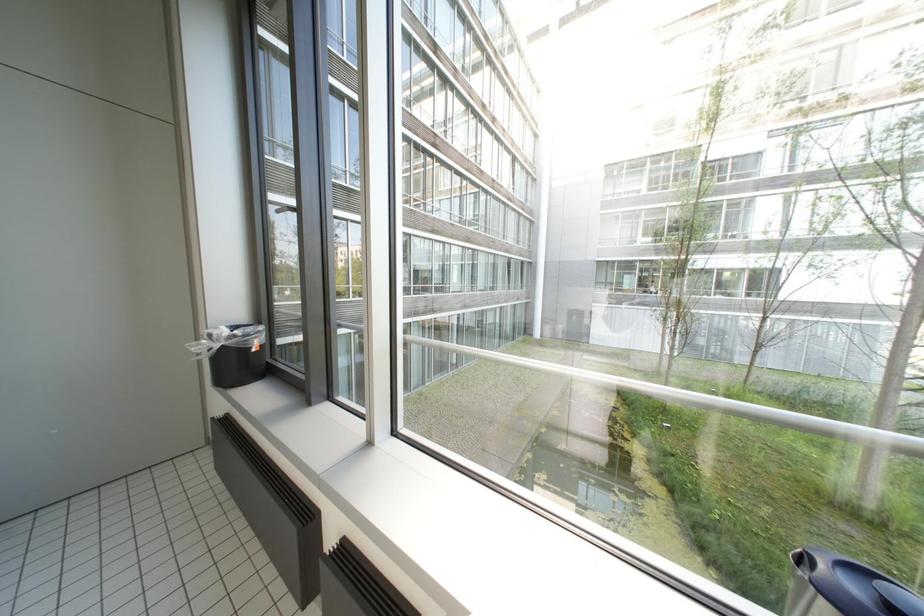
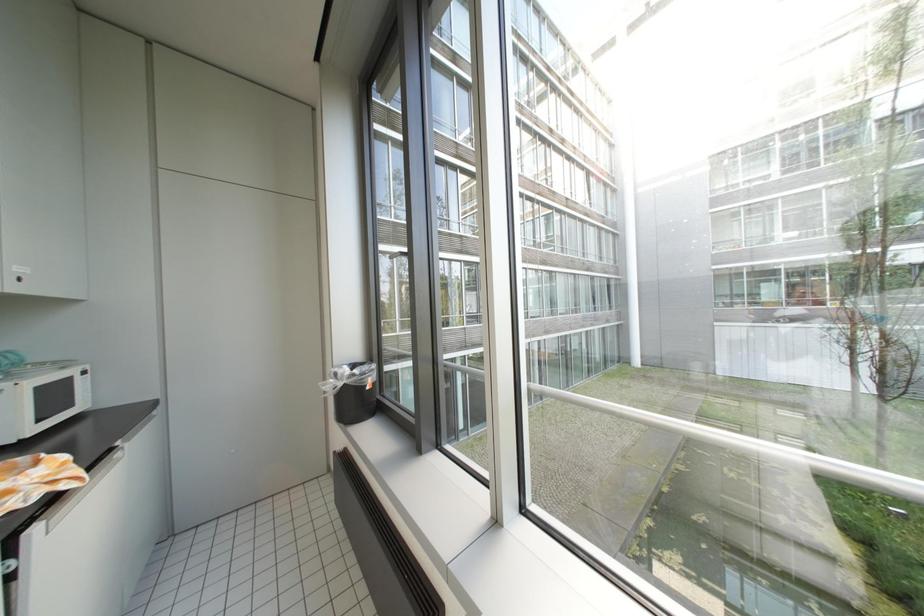
Question: The images are taken continuously from a first-person perspective. In which direction is your viewpoint rotating?

Choices:
 (A) Left
 (B) Right
 (C) Up
 (D) Down

Answer: (A)